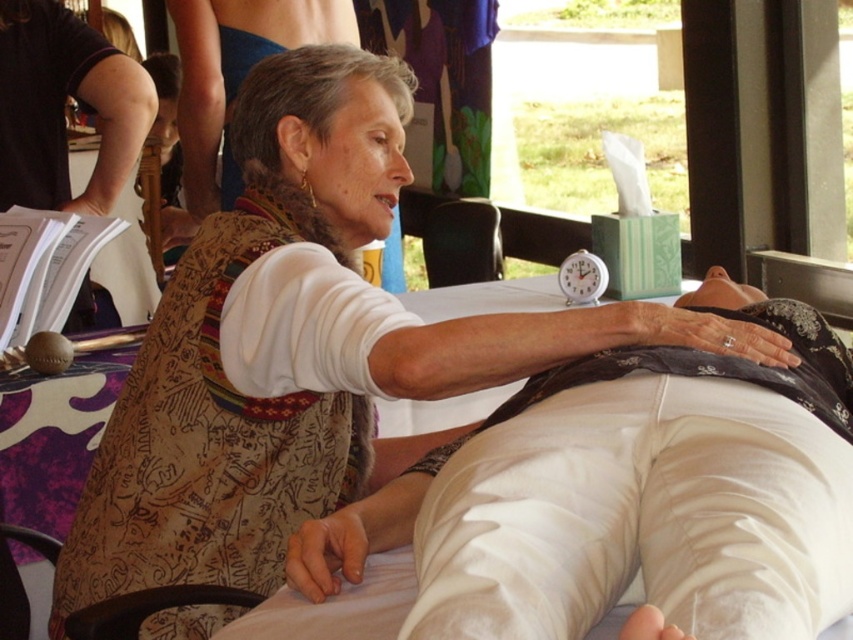
Question: Is white cotton pants at center wider than white plastic alarm clock at upper center?

Choices:
 (A) yes
 (B) no

Answer: (A)

Question: Can you confirm if white cotton pants at center is positioned to the left of white plastic alarm clock at upper center?

Choices:
 (A) no
 (B) yes

Answer: (B)

Question: Which of the following is the closest to the observer?

Choices:
 (A) (241, 620)
 (B) (576, 292)

Answer: (A)

Question: Does white cotton pants at center come in front of white plastic alarm clock at upper center?

Choices:
 (A) no
 (B) yes

Answer: (B)

Question: Which object is closer to the camera taking this photo?

Choices:
 (A) white cotton pants at center
 (B) white plastic alarm clock at upper center

Answer: (A)